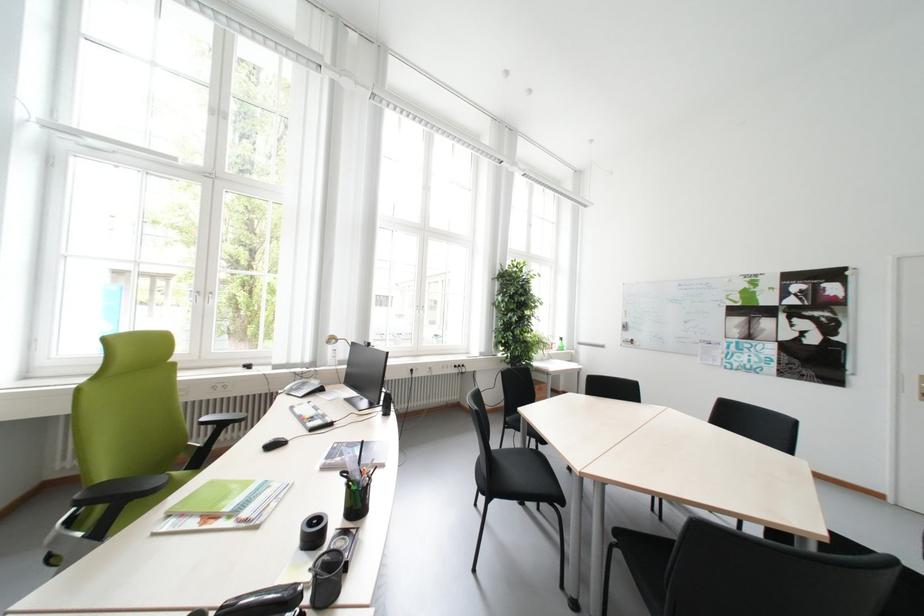
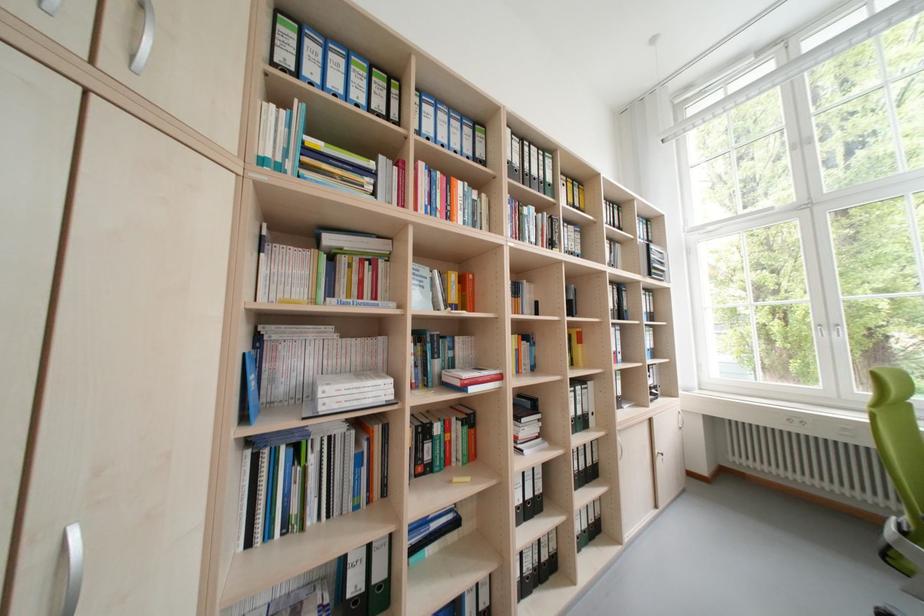
Question: The images are taken continuously from a first-person perspective. In which direction is your viewpoint rotating?

Choices:
 (A) Left
 (B) Right
 (C) Up
 (D) Down

Answer: (A)